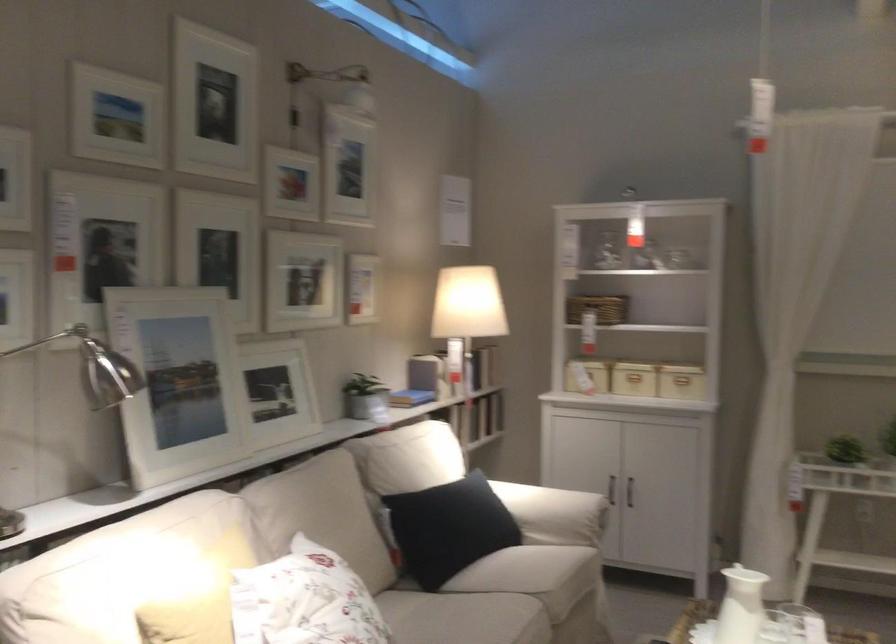
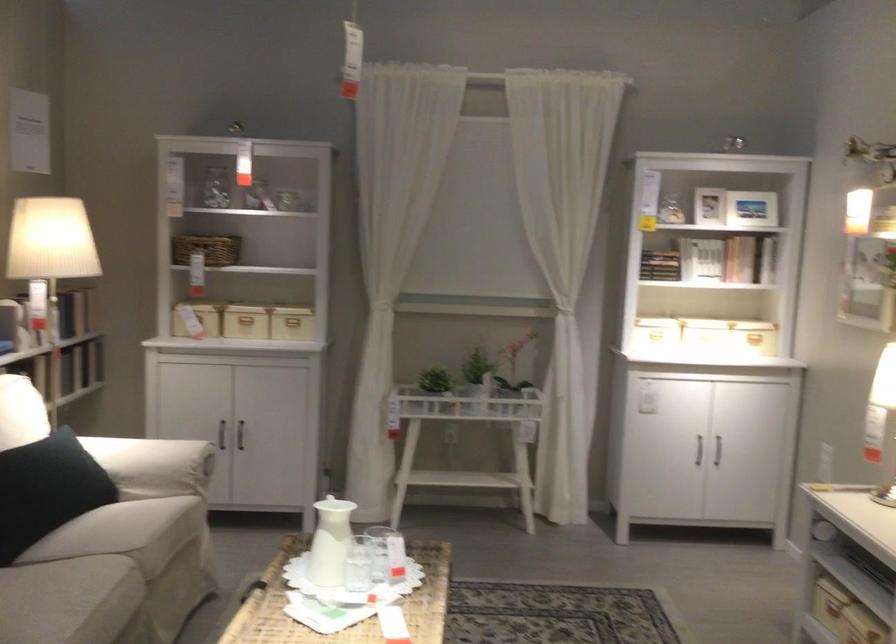
In the second image, find the point that corresponds to pixel 596 301 in the first image.

(207, 249)